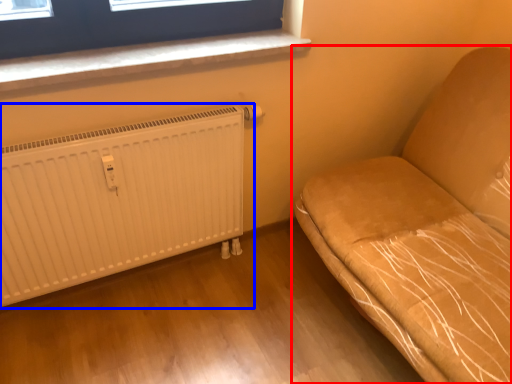
Question: Which object is further to the camera taking this photo, furniture (highlighted by a red box) or radiator (highlighted by a blue box)?

Choices:
 (A) furniture
 (B) radiator

Answer: (B)